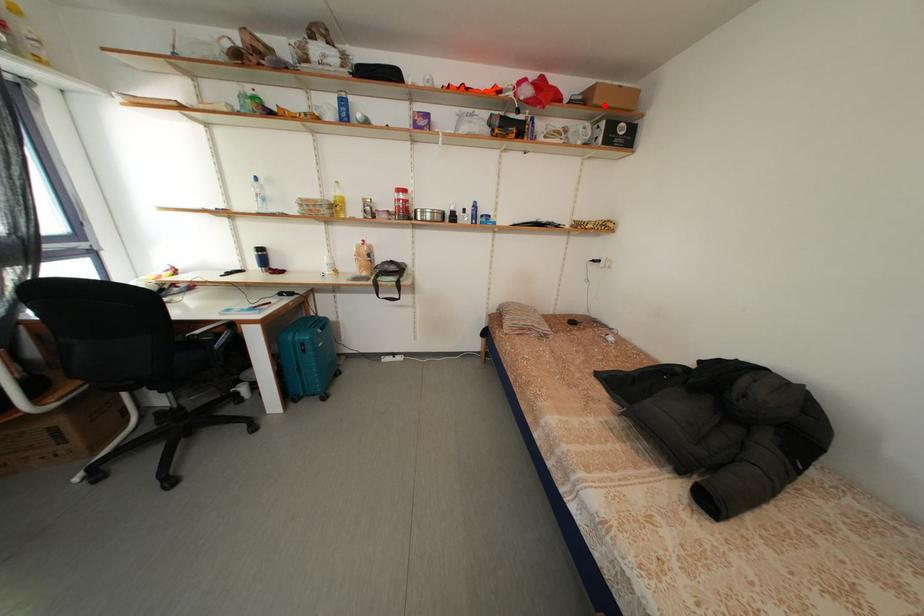
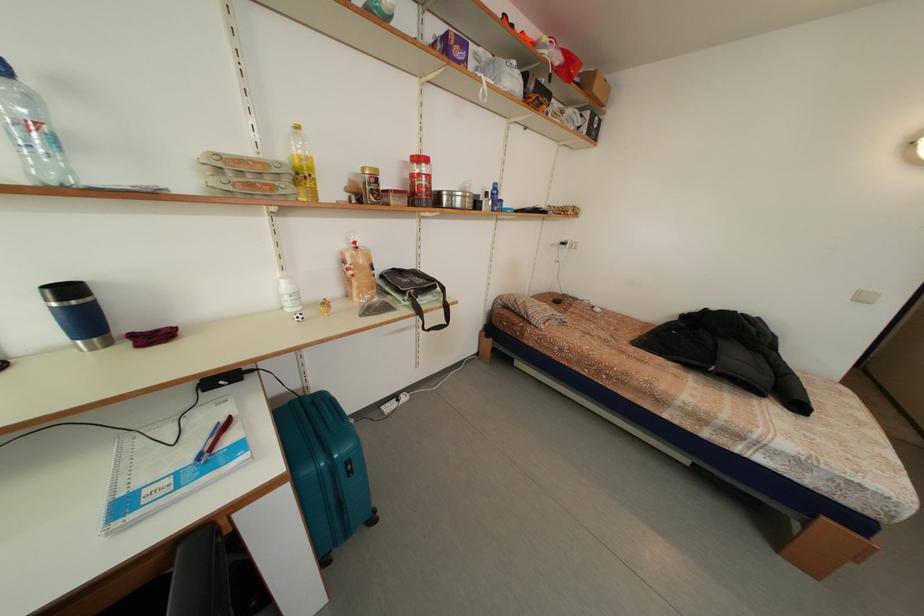
The point at the highlighted location is marked in the first image. Where is the corresponding point in the second image?

(603, 95)